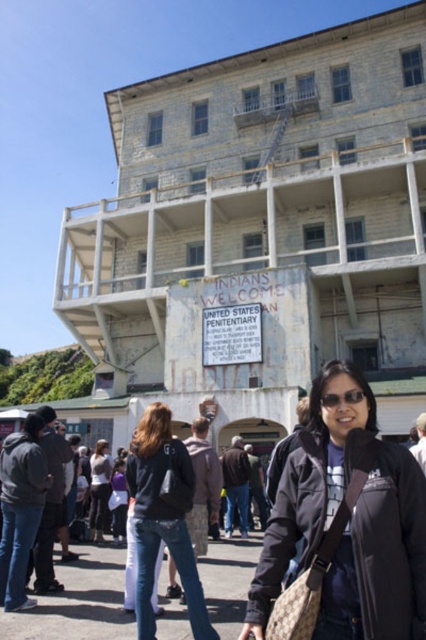
Question: Which point is farther from the camera taking this photo?

Choices:
 (A) (146, 451)
 (B) (316, 500)

Answer: (A)

Question: Can you confirm if black matte jacket at lower right is positioned to the right of denim jeans at center?

Choices:
 (A) yes
 (B) no

Answer: (A)

Question: Does black matte jacket at lower right appear on the left side of denim jeans at center?

Choices:
 (A) yes
 (B) no

Answer: (B)

Question: From the image, what is the correct spatial relationship of black matte jacket at lower right in relation to denim jeans at center?

Choices:
 (A) above
 (B) below

Answer: (A)